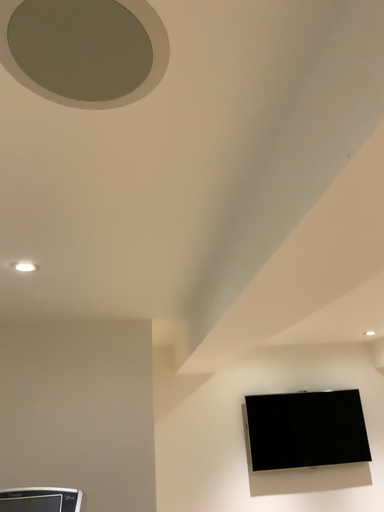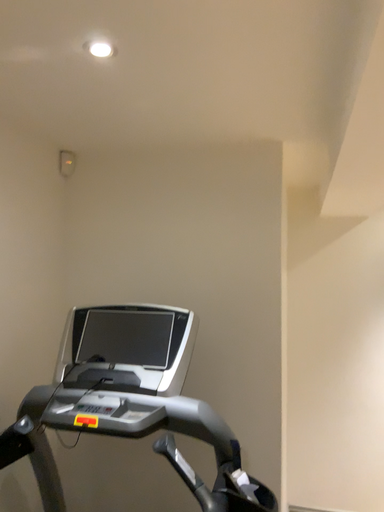
Question: How did the camera likely rotate when shooting the video?

Choices:
 (A) rotated downward
 (B) rotated upward

Answer: (A)